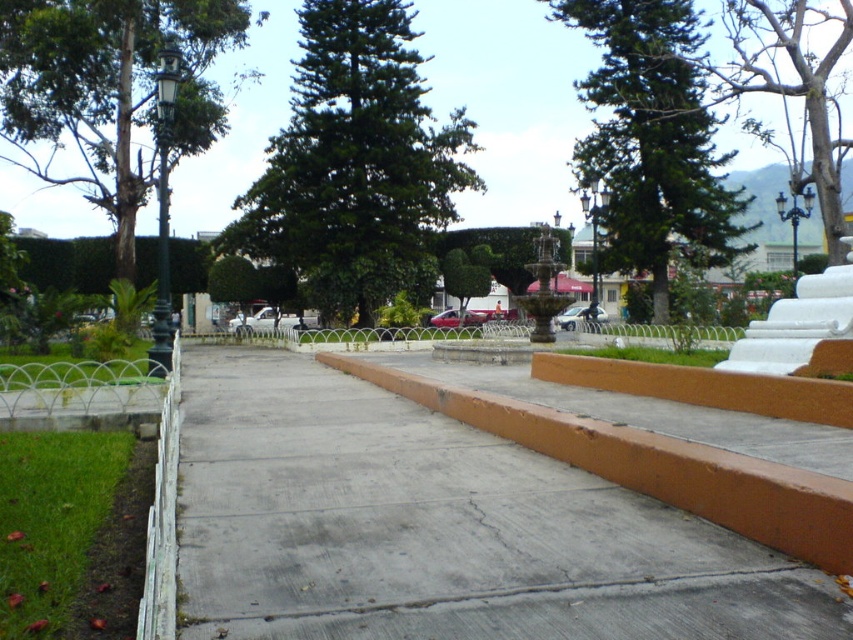
Question: Which point is farther to the camera?

Choices:
 (A) green leafy tree at center
 (B) bare wood tree at upper right

Answer: (A)

Question: Can you confirm if green leafy tree at center is positioned to the left of green textured tree at center?

Choices:
 (A) yes
 (B) no

Answer: (A)

Question: Does gray concrete at center appear on the left side of green leafy tree at center?

Choices:
 (A) yes
 (B) no

Answer: (B)

Question: Which point is farther to the camera?

Choices:
 (A) gray concrete at center
 (B) bare wood tree at upper right

Answer: (B)

Question: Which point is farther to the camera?

Choices:
 (A) (32, 115)
 (B) (300, 29)
 (C) (816, 28)

Answer: (B)

Question: Does gray concrete at center appear on the right side of green textured tree at left?

Choices:
 (A) yes
 (B) no

Answer: (A)